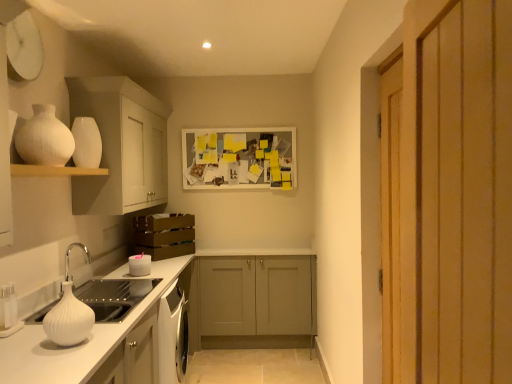
What is the approximate height of white glossy vase at left, the 2th vase when ordered from back to front?

The height of white glossy vase at left, the 2th vase when ordered from back to front, is 9.79 inches.

The image size is (512, 384). What do you see at coordinates (68, 319) in the screenshot?
I see `white glossy vase at left, which ranks as the 2th vase in top-to-bottom order` at bounding box center [68, 319].

Image resolution: width=512 pixels, height=384 pixels. What do you see at coordinates (239, 158) in the screenshot?
I see `white matte picture frame at center` at bounding box center [239, 158].

The width and height of the screenshot is (512, 384). What do you see at coordinates (44, 138) in the screenshot?
I see `white glossy vase at upper left` at bounding box center [44, 138].

What is the approximate width of white glossy vase at upper left?

white glossy vase at upper left is 9.13 inches in width.

Locate an element on the screen. The image size is (512, 384). white glossy vase at upper left, positioned as the first vase in back-to-front order is located at coordinates (86, 143).

You are a GUI agent. You are given a task and a screenshot of the screen. Output one action in this format:
    pyautogui.click(x=<x>, y=<y>)
    Task: Click on the white glossy vase at left, which is the 1th vase from right to left
    
    Given the screenshot: What is the action you would take?
    pyautogui.click(x=68, y=319)

Is point (91, 165) farther from camera compared to point (267, 138)?

No, it is not.

Does white glossy vase at upper left, which is counted as the 2th vase, starting from the front, have a greater height compared to white matte picture frame at center?

In fact, white glossy vase at upper left, which is counted as the 2th vase, starting from the front, may be shorter than white matte picture frame at center.

Is white glossy vase at upper left, the 2th vase viewed from the right, with white matte picture frame at center?

No, white glossy vase at upper left, the 2th vase viewed from the right, is not touching white matte picture frame at center.

Considering the sizes of white matte shelf at upper left and wooden door at right in the image, is white matte shelf at upper left wider or thinner than wooden door at right?

white matte shelf at upper left is wider than wooden door at right.

How different are the orientations of white matte shelf at upper left and wooden door at right in degrees?

There is a 174-degree angle between the facing directions of white matte shelf at upper left and wooden door at right.

From a real-world perspective, which is physically above, white matte shelf at upper left or wooden door at right?

white matte shelf at upper left.

Is wooden door at right inside white matte shelf at upper left?

That's incorrect, wooden door at right is not inside white matte shelf at upper left.

From the image's perspective, is wooden door at right positioned above or below white matte candle at lower left?

Clearly, from the image's perspective, wooden door at right is above white matte candle at lower left.

Can you tell me how much wooden door at right and white matte candle at lower left differ in facing direction?

There is a 174-degree angle between the facing directions of wooden door at right and white matte candle at lower left.

From a real-world perspective, which is physically below, wooden door at right or white matte candle at lower left?

white matte candle at lower left, from a real-world perspective.

From a real-world perspective, between white matte sink at lower left and white glossy vase at upper left, positioned as the first vase in back-to-front order, who is vertically higher?

white glossy vase at upper left, positioned as the first vase in back-to-front order.

Which object is thinner, white matte sink at lower left or white glossy vase at upper left, positioned as the first vase in back-to-front order?

Thinner between the two is white matte sink at lower left.

Is white matte sink at lower left shorter than white glossy vase at upper left, which is counted as the 2th vase, starting from the front?

Yes.

Is the depth of white matte sink at lower left greater than that of matte gray cabinet at center, which is the 2th cabinetry in left-to-right order?

That is False.

From the image's perspective, is white matte sink at lower left located above or below matte gray cabinet at center, which is the 1th cabinetry in back-to-front order?

white matte sink at lower left is above matte gray cabinet at center, which is the 1th cabinetry in back-to-front order.

Is white matte sink at lower left touching matte gray cabinet at center, which is the 2th cabinetry in left-to-right order?

No, white matte sink at lower left is not in contact with matte gray cabinet at center, which is the 2th cabinetry in left-to-right order.

Which is less distant, (x=84, y=168) or (x=41, y=108)?

Point (x=84, y=168) appears to be farther away from the viewer than point (x=41, y=108).

Consider the image. Is white matte shelf at upper left beside white glossy vase at upper left?

white matte shelf at upper left and white glossy vase at upper left are not in contact.

From a real-world perspective, which object rests below the other?

white matte shelf at upper left is physically lower.

Can you confirm if white matte shelf at upper left is smaller than white glossy vase at upper left?

Correct, white matte shelf at upper left occupies less space than white glossy vase at upper left.

Can you confirm if white matte sink at lower left is positioned to the right of white matte candle at lower left?

No, white matte sink at lower left is not to the right of white matte candle at lower left.

From the image's perspective, is white matte sink at lower left above or below white matte candle at lower left?

Based on their image positions, white matte sink at lower left is located beneath white matte candle at lower left.

Looking at this image, considering the relative sizes of white matte sink at lower left and white matte candle at lower left in the image provided, is white matte sink at lower left smaller than white matte candle at lower left?

No.

How distant is white matte sink at lower left from white matte candle at lower left?

They are 12.04 inches apart.

Image resolution: width=512 pixels, height=384 pixels. In the image, there is a white matte picture frame at center. In order to click on vase above it (from the image's perspective) in this screenshot , I will do `click(86, 143)`.

Where is `shelf to the left of wooden door at right`? The height and width of the screenshot is (384, 512). shelf to the left of wooden door at right is located at coordinates (53, 171).

Which object lies nearer to the anchor point white matte sink at lower left, wooden door at right or matte gray cabinet at center, the second cabinetry positioned from the top?

matte gray cabinet at center, the second cabinetry positioned from the top.

Which object lies nearer to the anchor point white glossy vase at upper left, wooden door at right or white matte picture frame at center?

wooden door at right lies closer to white glossy vase at upper left than the other object.

From the picture: Considering their positions, is white glossy vase at upper left, which is counted as the 2th vase, starting from the front, positioned further to white glossy vase at left, the 2th vase when ordered from back to front, than white matte cabinet at upper left, marked as the first cabinetry in a front-to-back arrangement?

white matte cabinet at upper left, marked as the first cabinetry in a front-to-back arrangement.

Consider the image. From the image, which object appears to be farther from white matte candle at lower left, white matte picture frame at center or white glossy vase at upper left, arranged as the second vase when ordered from the bottom?

white matte picture frame at center lies further to white matte candle at lower left than the other object.

From the image, which object appears to be farther from matte gray cabinet at center, the first cabinetry in the right-to-left sequence, white matte cabinet at upper left, positioned as the second cabinetry in bottom-to-top order, or white glossy vase at left, which is the 1th vase in bottom-to-top order?

Among the two, white glossy vase at left, which is the 1th vase in bottom-to-top order, is located further to matte gray cabinet at center, the first cabinetry in the right-to-left sequence.

Looking at the image, which one is located closer to white glossy vase at left, acting as the 1th vase starting from the front, matte gray cabinet at center, placed as the second cabinetry when sorted from front to back, or white glossy vase at upper left, which is counted as the 2th vase, starting from the front?

The object closer to white glossy vase at left, acting as the 1th vase starting from the front, is white glossy vase at upper left, which is counted as the 2th vase, starting from the front.

When comparing their distances from white matte shelf at upper left, does white matte cabinet at upper left, placed as the first cabinetry when sorted from left to right, or wooden door at right seem closer?

Among the two, white matte cabinet at upper left, placed as the first cabinetry when sorted from left to right, is located nearer to white matte shelf at upper left.

Estimate the real-world distances between objects in this image. Which object is further from white matte candle at lower left, white glossy vase at upper left or white matte picture frame at center?

Among the two, white matte picture frame at center is located further to white matte candle at lower left.

The image size is (512, 384). Find the location of `glass vase located between white matte shelf at upper left and white matte cabinet at upper left, positioned as the second cabinetry in bottom-to-top order, in the depth direction`. glass vase located between white matte shelf at upper left and white matte cabinet at upper left, positioned as the second cabinetry in bottom-to-top order, in the depth direction is located at coordinates (44, 138).

The image size is (512, 384). I want to click on appliance between white glossy vase at upper left and matte gray cabinet at center, which ranks as the first cabinetry in bottom-to-top order, in the front-back direction, so point(139,265).

The width and height of the screenshot is (512, 384). What are the coordinates of `cabinetry between white matte sink at lower left and white matte candle at lower left along the z-axis` in the screenshot? It's located at (121, 146).

You are a GUI agent. You are given a task and a screenshot of the screen. Output one action in this format:
    pyautogui.click(x=<x>, y=<y>)
    Task: Click on the glass vase between white glossy vase at upper left, positioned as the first vase in back-to-front order, and white matte sink at lower left vertically
    This screenshot has width=512, height=384.
    Given the screenshot: What is the action you would take?
    pyautogui.click(x=44, y=138)